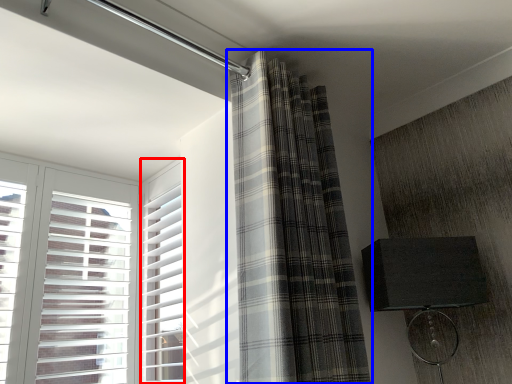
Question: Which object appears farthest to the camera in this image, window frame (highlighted by a red box) or curtain (highlighted by a blue box)?

Choices:
 (A) window frame
 (B) curtain

Answer: (A)